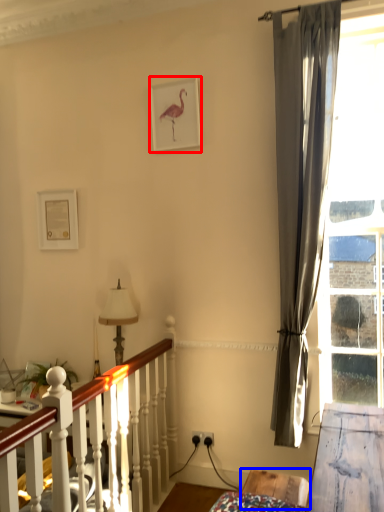
Question: Among these objects, which one is nearest to the camera, picture frame (highlighted by a red box) or furniture (highlighted by a blue box)?

Choices:
 (A) picture frame
 (B) furniture

Answer: (B)